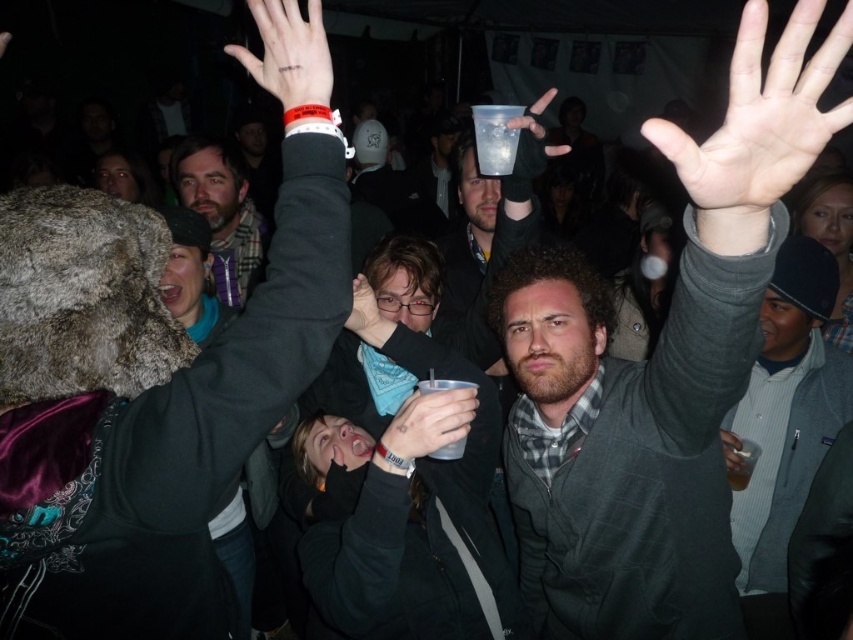
You are standing at the entrance of the concert venue and want to find the matte gray sweater at upper right. Based on the coordinates provided, in which direction should you look to locate it?

The matte gray sweater at upper right is located at coordinates point [154,400], which means it is positioned towards the upper right area of the image. You should look towards the upper right direction to find it.

You are at a concert and want to know if the gray woolen sweater at upper right is below the pale skin palm at upper center. Can you confirm this based on the scene?

Yes, the gray woolen sweater at upper right is positioned under the pale skin palm at upper center according to the description.

You are at a concert and want to take a photo of the matte gray sweater at upper right and the matte black hand at upper center. Which object should you focus on first to ensure both are in focus?

You should focus on the matte gray sweater at upper right first because it is closer to you than the matte black hand at upper center. This way, adjusting the focus from near to far will help both objects be in focus.